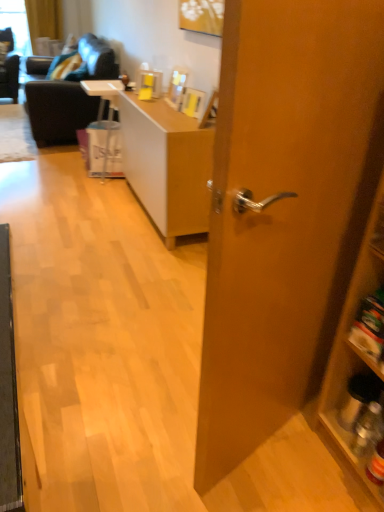
You are a GUI agent. You are given a task and a screenshot of the screen. Output one action in this format:
    pyautogui.click(x=<x>, y=<y>)
    Task: Click on the vacant space in front of wooden door at center
    The image size is (384, 512).
    Given the screenshot: What is the action you would take?
    pyautogui.click(x=282, y=466)